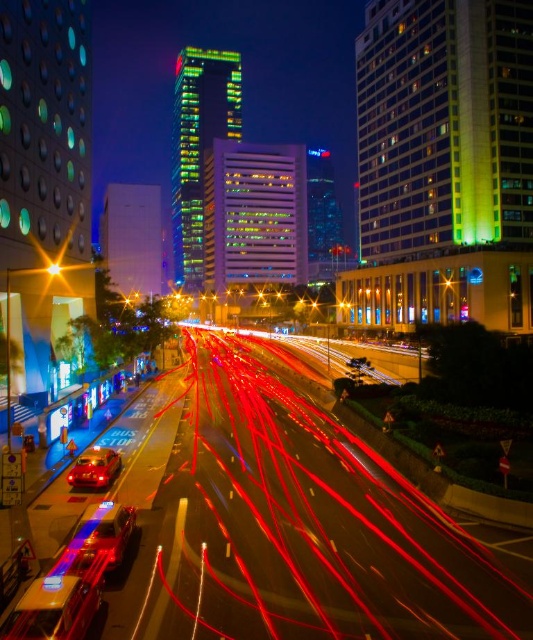
From the picture: You are a photographer trying to capture both the metallic silver car at center and the shiny red car at center in a single frame. Given that your camera can only focus on one car at a time, which car should you focus on to ensure it appears larger in the final photo?

The metallic silver car at center is bigger than the shiny red car at center, so focusing on the metallic silver car at center will ensure it appears larger in the photo.

You are a photographer standing on the sidewalk and want to capture a photo of the metallic silver car at center and the bright yellow light at center. Can you frame both objects in the same shot without moving your position?

Yes, the metallic silver car at center is positioned under the bright yellow light at center, so they are in the same location and can be captured in a single frame.